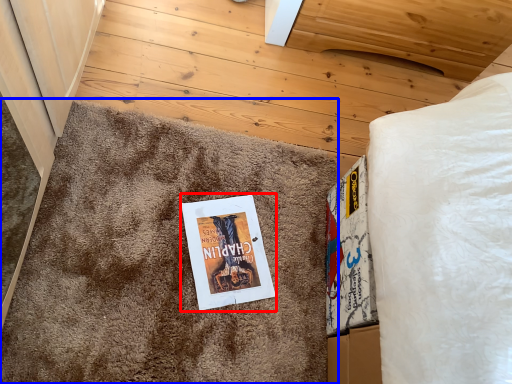
Question: Among these objects, which one is farthest to the camera, fiction book (highlighted by a red box) or doormat (highlighted by a blue box)?

Choices:
 (A) fiction book
 (B) doormat

Answer: (A)